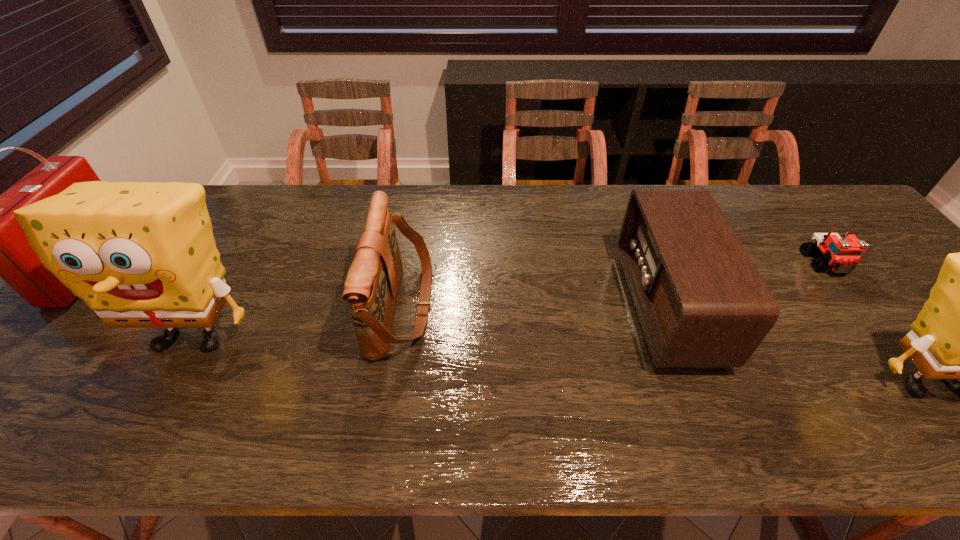
Identify the location of free location that satisfies the following two spatial constraints: 1. on the front-facing side of the Lego; 2. on the front-facing side of the radio receiver. click(x=858, y=306).

The height and width of the screenshot is (540, 960). I want to click on vacant space that satisfies the following two spatial constraints: 1. on the front-facing side of the shortest object; 2. on the front-facing side of the third object from left to right, so click(858, 306).